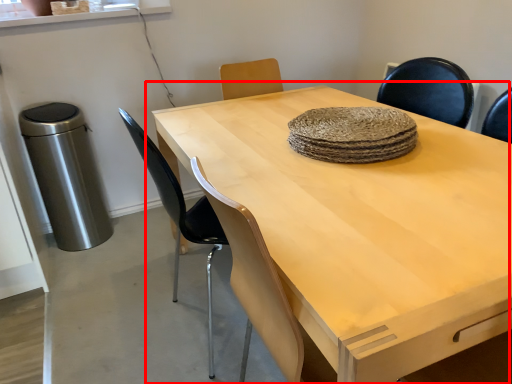
Question: In this image, where is table (annotated by the red box) located relative to chair?

Choices:
 (A) right
 (B) left

Answer: (A)